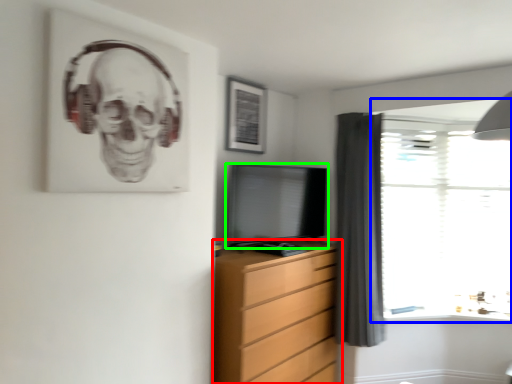
Question: Which is farther away from chest of drawers (highlighted by a red box)? window (highlighted by a blue box) or television (highlighted by a green box)?

Choices:
 (A) window
 (B) television

Answer: (A)